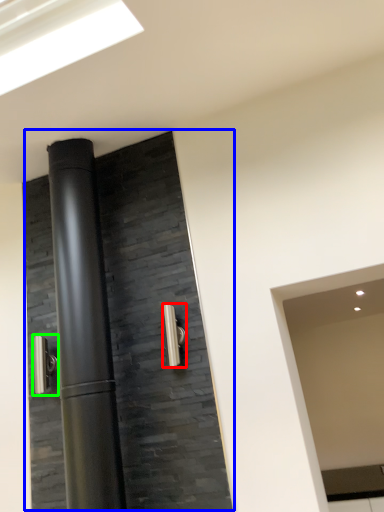
Question: Estimate the real-world distances between objects in this image. Which object is farther from door handle (highlighted by a red box), door (highlighted by a blue box) or door handle (highlighted by a green box)?

Choices:
 (A) door
 (B) door handle

Answer: (B)